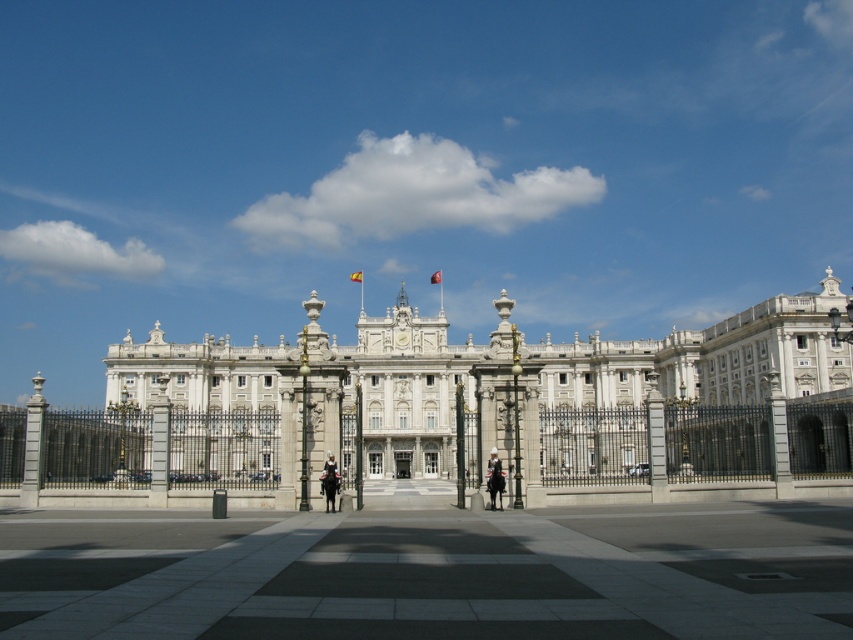
You are a visitor standing at the entrance of the grand building. You see the gray concrete plaza at center and the smooth black uniform at center. How far apart are these two objects from each other?

The gray concrete plaza at center is 23.38 meters from the smooth black uniform at center.

You are standing in the plaza in front of the palace. You notice two points marked on the ground. The first point is at coordinates point (358, 365) and the second is at point (503, 486). If you are facing the palace, which point is closer to the building?

Point (358, 365) is behind point (503, 486), so the point closer to the palace is point (358, 365).

You are planning to host a small gathering in the plaza area. Given that the gray concrete plaza at center and the smooth black uniform at center are present, which object would be more suitable for placing chairs and tables for the event? Explain your choice based on their sizes.

The gray concrete plaza at center is more suitable for placing chairs and tables because it has a larger size compared to the smooth black uniform at center, providing enough space for the event setup.